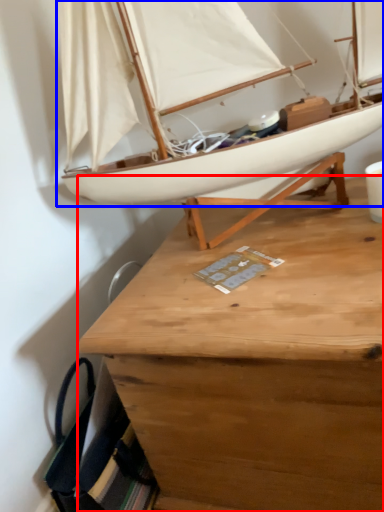
Question: Which object appears farthest to the camera in this image, desk (highlighted by a red box) or boat (highlighted by a blue box)?

Choices:
 (A) desk
 (B) boat

Answer: (A)